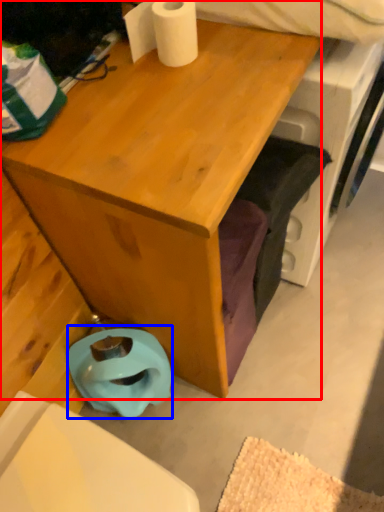
Question: Which object appears farthest to the camera in this image, desk (highlighted by a red box) or toilet bowl (highlighted by a blue box)?

Choices:
 (A) desk
 (B) toilet bowl

Answer: (B)